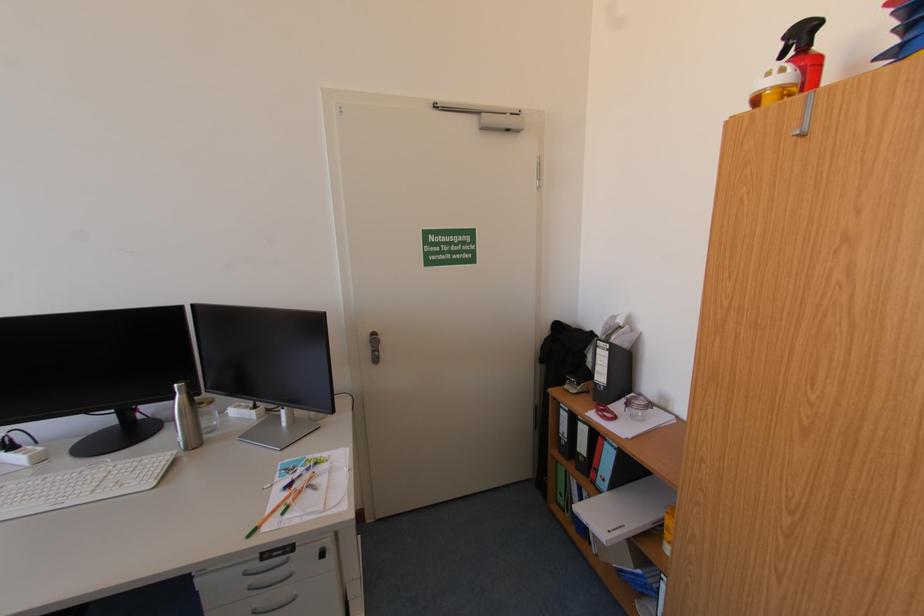
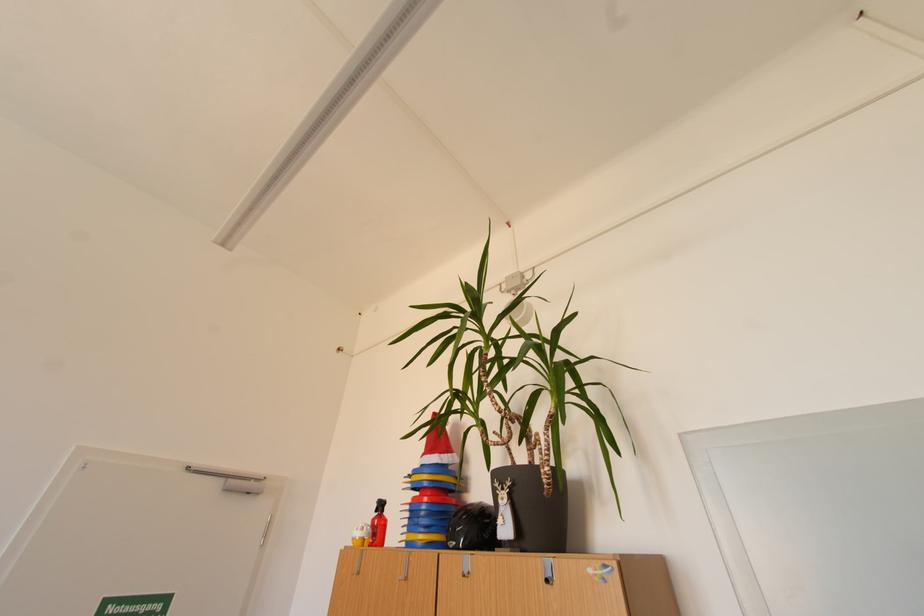
The first image is from the beginning of the video and the second image is from the end. How did the camera likely rotate when shooting the video?

The camera rotated toward right-up.